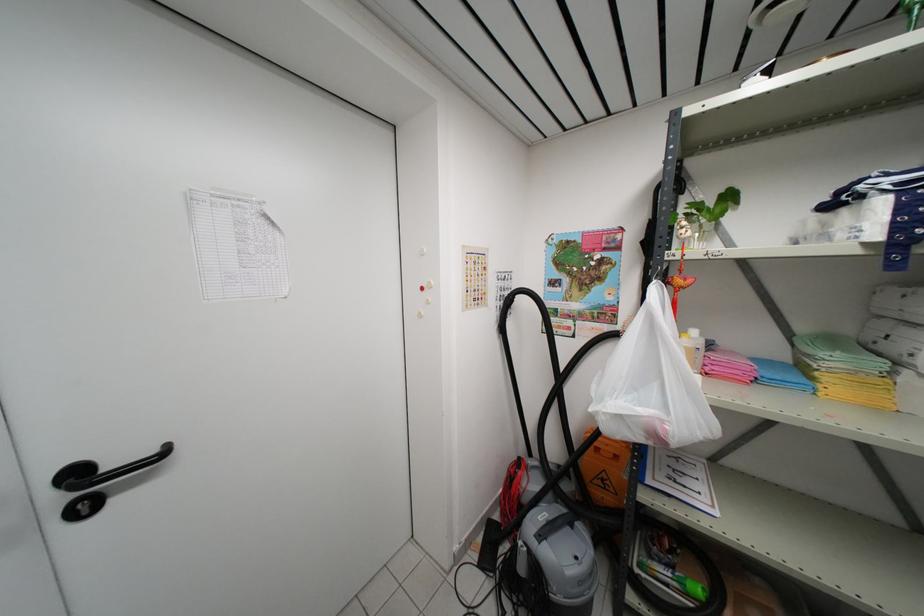
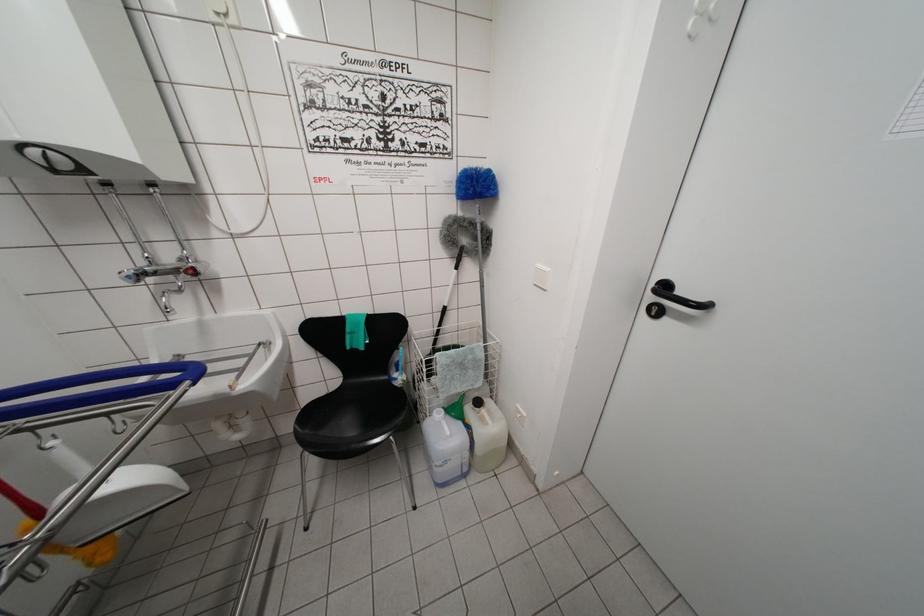
The point at (x=91, y=517) is marked in the first image. Where is the corresponding point in the second image?

(657, 318)